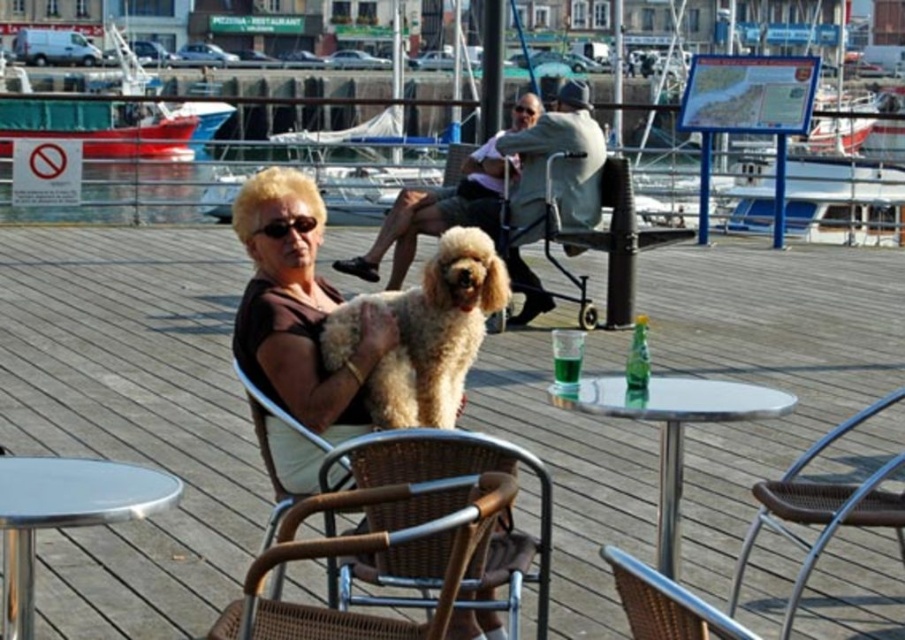
You are sitting at the beige wicker chair at center and want to get up to grab your drink from the table to the right. Is the brown woven chair at lower right blocking your path?

The brown woven chair at lower right is behind the beige wicker chair at center, so it is not blocking your path to the table to the right.